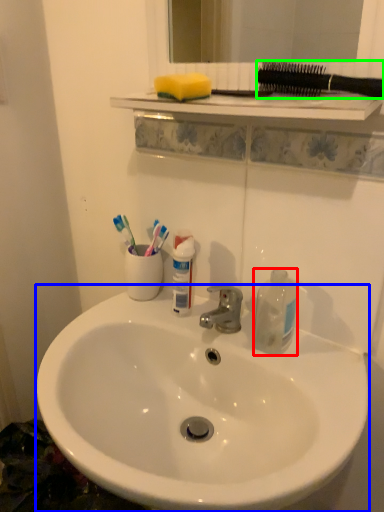
Question: Which is nearer to the bottle (highlighted by a red box)? sink (highlighted by a blue box) or toothbrushes (highlighted by a green box).

Choices:
 (A) sink
 (B) toothbrushes

Answer: (A)